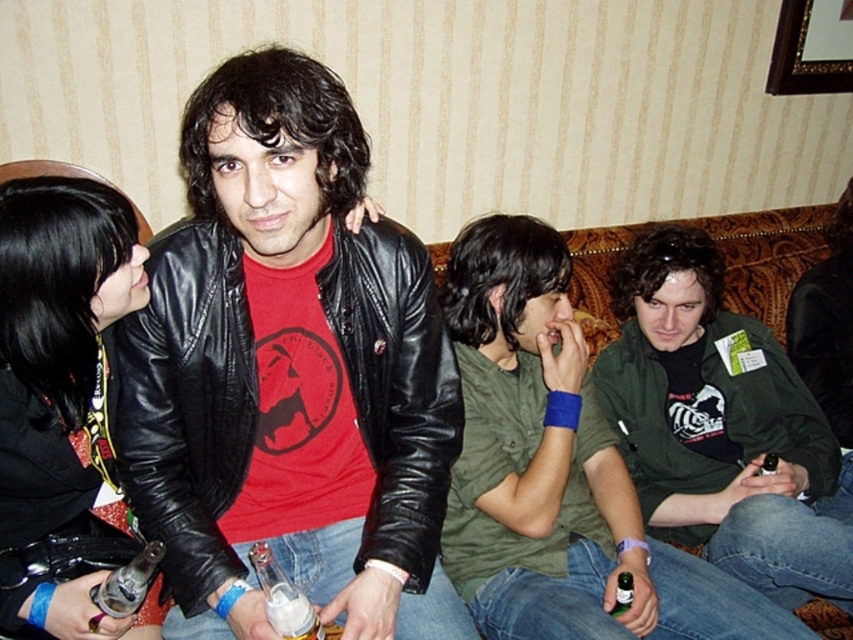
Does matte black leather jacket at center appear over green glass bottle at lower center?

Yes, matte black leather jacket at center is above green glass bottle at lower center.

Can you confirm if matte black leather jacket at center is shorter than green glass bottle at lower center?

In fact, matte black leather jacket at center may be taller than green glass bottle at lower center.

Which is in front, point (230, 502) or point (624, 576)?

Positioned in front is point (230, 502).

Image resolution: width=853 pixels, height=640 pixels. I want to click on matte black leather jacket at center, so click(x=296, y=376).

Is wooden picture frame at upper right shorter than white frothy beer at lower left?

In fact, wooden picture frame at upper right may be taller than white frothy beer at lower left.

What do you see at coordinates (810, 49) in the screenshot?
I see `wooden picture frame at upper right` at bounding box center [810, 49].

The width and height of the screenshot is (853, 640). What do you see at coordinates (810, 49) in the screenshot?
I see `wooden picture frame at upper right` at bounding box center [810, 49].

The height and width of the screenshot is (640, 853). In order to click on wooden picture frame at upper right in this screenshot , I will do point(810,49).

Measure the distance between point (x=434, y=312) and camera.

Point (x=434, y=312) is 1.31 meters away from camera.

Which of these two, matte black leather jacket at center or white frothy beer at lower left, stands shorter?

With less height is white frothy beer at lower left.

What do you see at coordinates (296, 376) in the screenshot? I see `matte black leather jacket at center` at bounding box center [296, 376].

Identify the location of matte black leather jacket at center. The height and width of the screenshot is (640, 853). (296, 376).